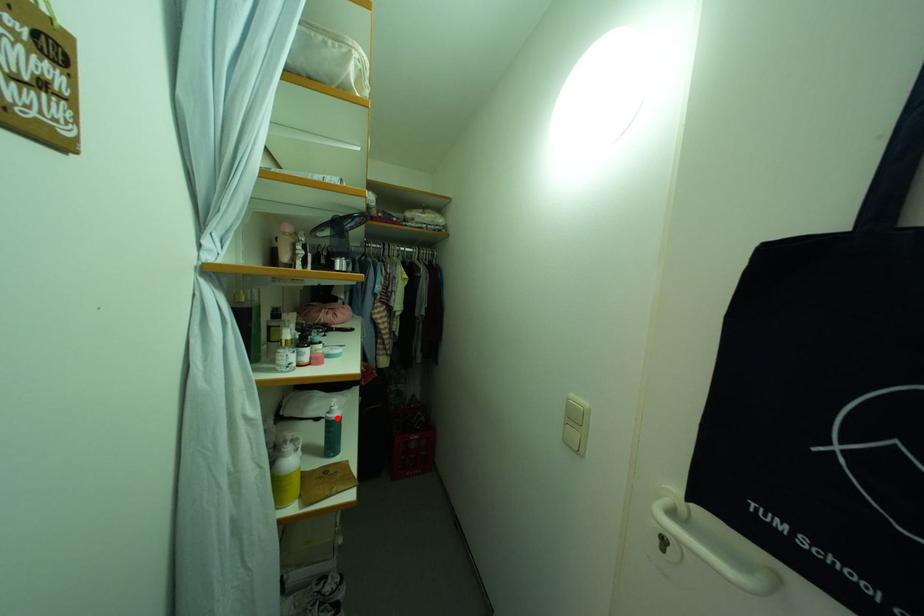
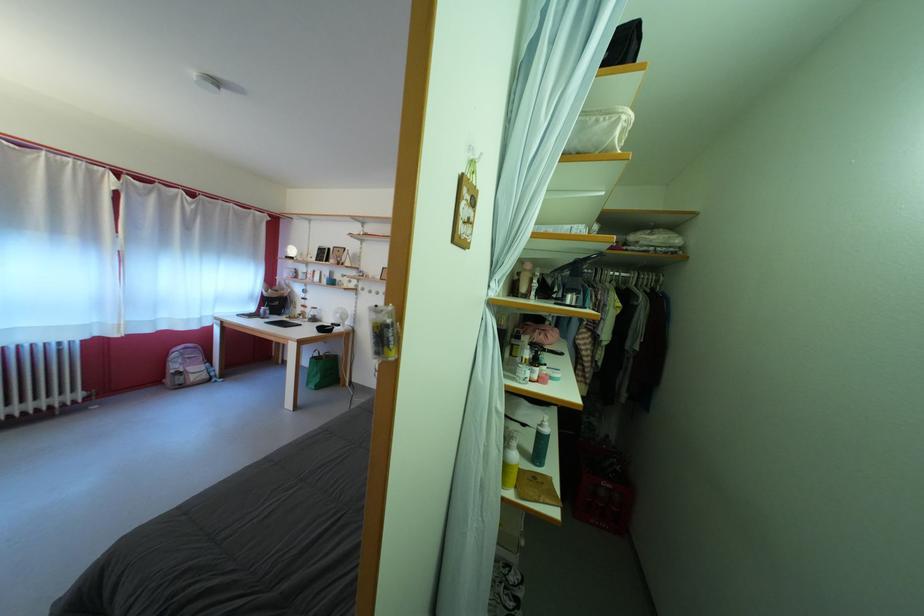
Find the pixel in the second image that matches the highlighted location in the first image.

(549, 431)